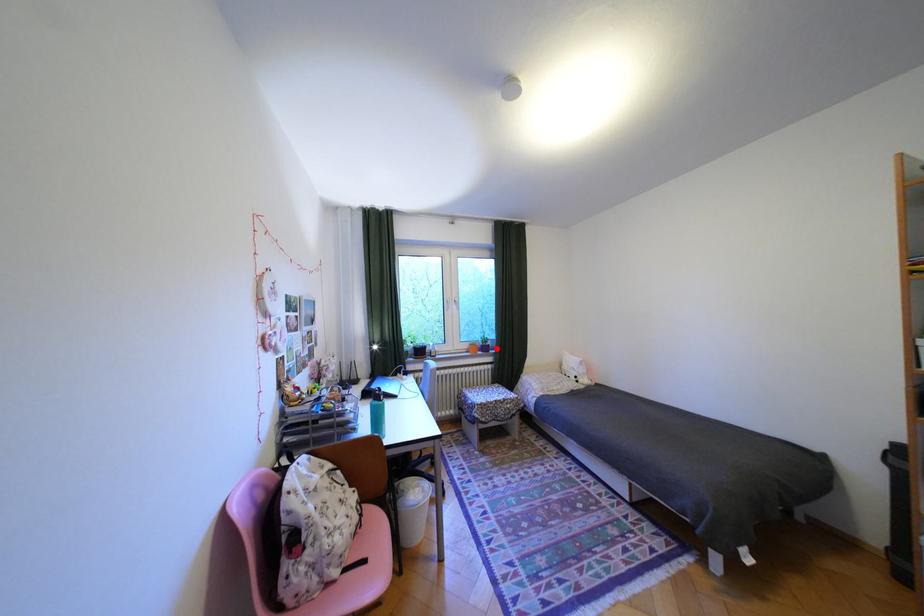
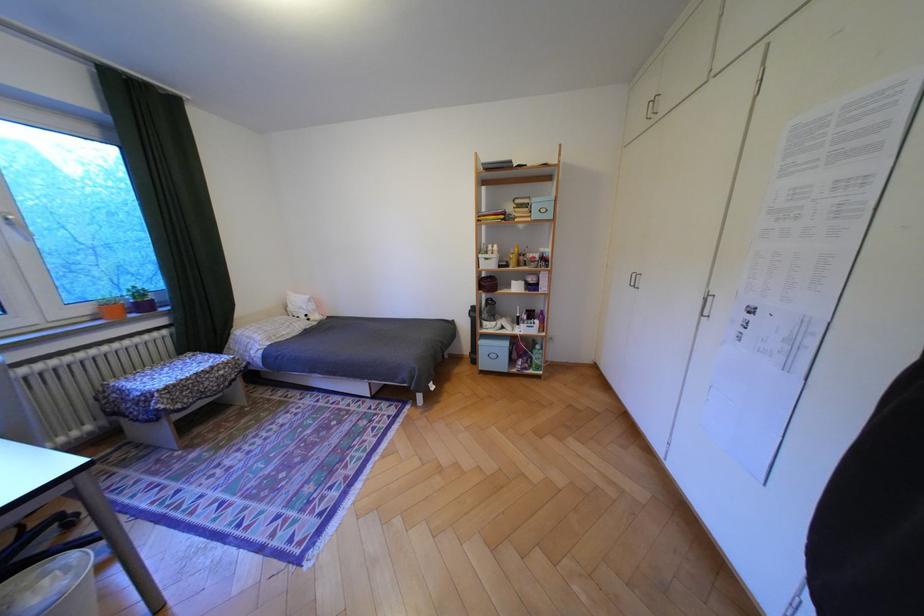
Find the pixel in the second image that matches the highlighted location in the first image.

(155, 307)